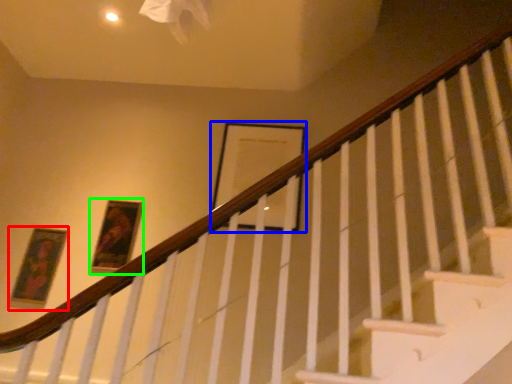
Question: Which object is positioned closest to picture frame (highlighted by a red box)? Select from picture frame (highlighted by a blue box) and picture frame (highlighted by a green box).

Choices:
 (A) picture frame
 (B) picture frame

Answer: (B)